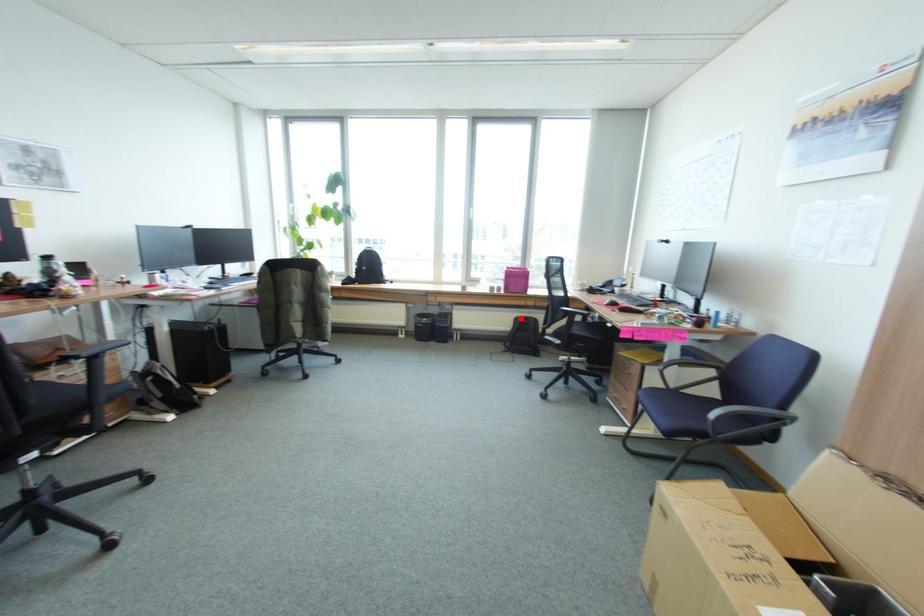
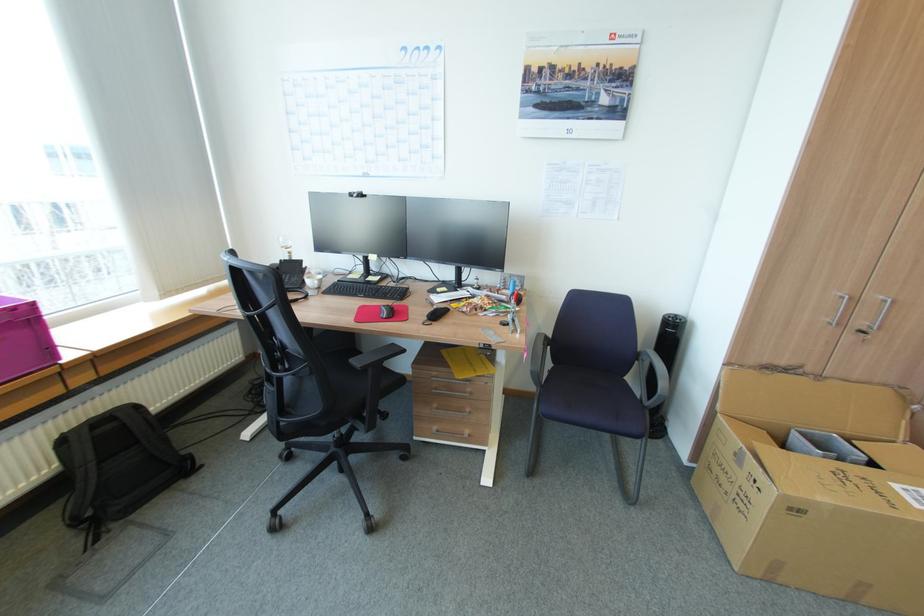
The point at the highlighted location is marked in the first image. Where is the corresponding point in the second image?

(68, 440)